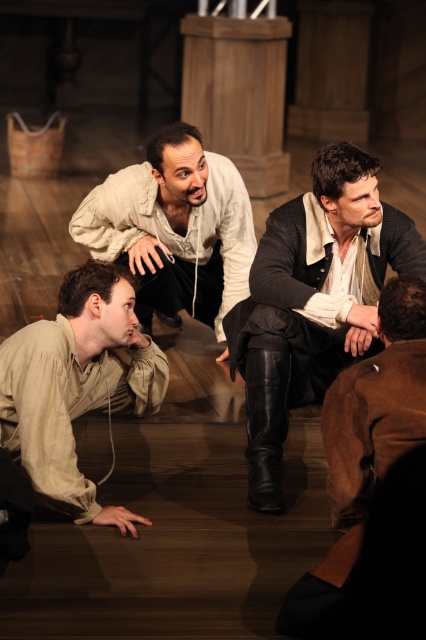
You are an actor in a historical play and need to quickly move from the leather boots at center to the brown leather jacket at lower right during a scene. Which direction should you move towards?

You should move towards the right because the leather boots at center is to the left of the brown leather jacket at lower right.

You are a costume designer preparing for a Renaissance play and need to ensure that two jackets fit through a narrow doorway. The doorway is exactly as wide as the brown leather jacket at lower right. Can the light beige leather jacket at center pass through the doorway without needing to be folded?

The light beige leather jacket at center is wider than the brown leather jacket at lower right. Since the doorway is only as wide as the brown leather jacket at lower right, the light beige leather jacket at center cannot pass through without being folded.

You are directing a play and need to adjust the actors based on their clothing. Which actor is positioned lower in the scene between the matte beige shirt at lower left and the light beige leather jacket at center?

Result: The matte beige shirt at lower left is positioned lower in the scene than the light beige leather jacket at center according to their vertical placement.